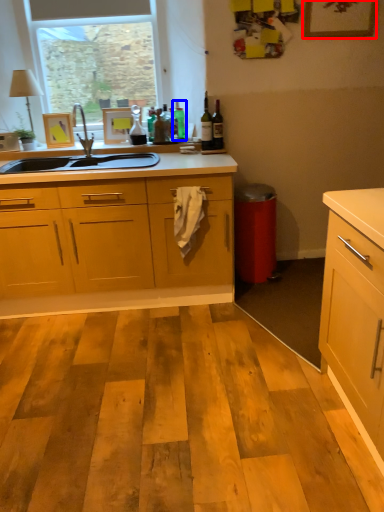
Question: Which of the following is the closest to the observer, picture frame (highlighted by a red box) or bottle (highlighted by a blue box)?

Choices:
 (A) picture frame
 (B) bottle

Answer: (A)